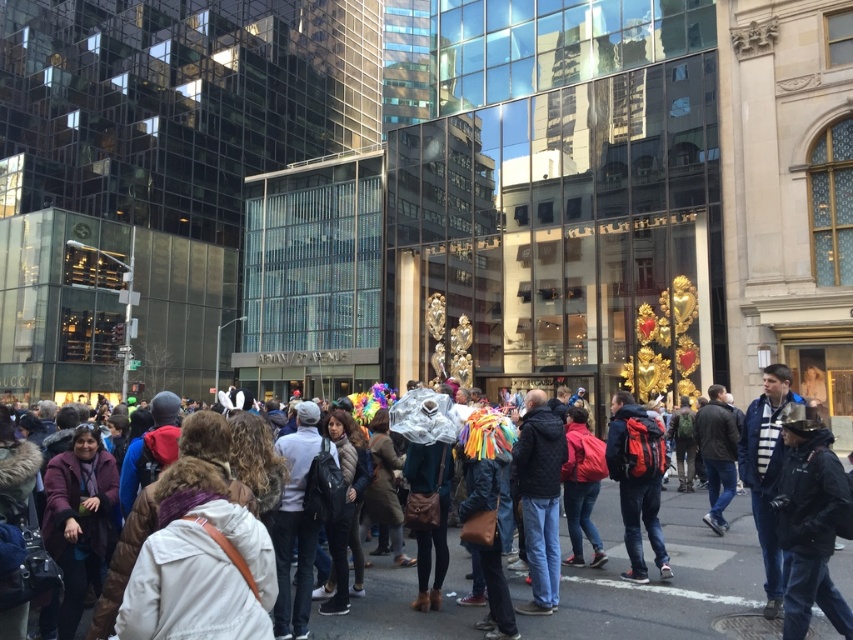
Question: Is black quilted jacket at center bigger than red backpack at center?

Choices:
 (A) yes
 (B) no

Answer: (A)

Question: Considering the real-world distances, which object is closest to the dark brown leather jacket at center?

Choices:
 (A) black quilted jacket at center
 (B) dark blue jeans at center
 (C) red backpack at center

Answer: (C)

Question: Estimate the real-world distances between objects in this image. Which object is farther from the dark blue jeans at center?

Choices:
 (A) black quilted jacket at center
 (B) dark brown leather jacket at center

Answer: (A)

Question: Can you confirm if red backpack at center is positioned to the right of dark blue jeans at center?

Choices:
 (A) yes
 (B) no

Answer: (B)

Question: Which object is the farthest from the red backpack at center?

Choices:
 (A) black quilted jacket at center
 (B) dark blue jeans at center

Answer: (B)

Question: Where is red backpack at center located in relation to dark blue jeans at center in the image?

Choices:
 (A) left
 (B) right

Answer: (A)